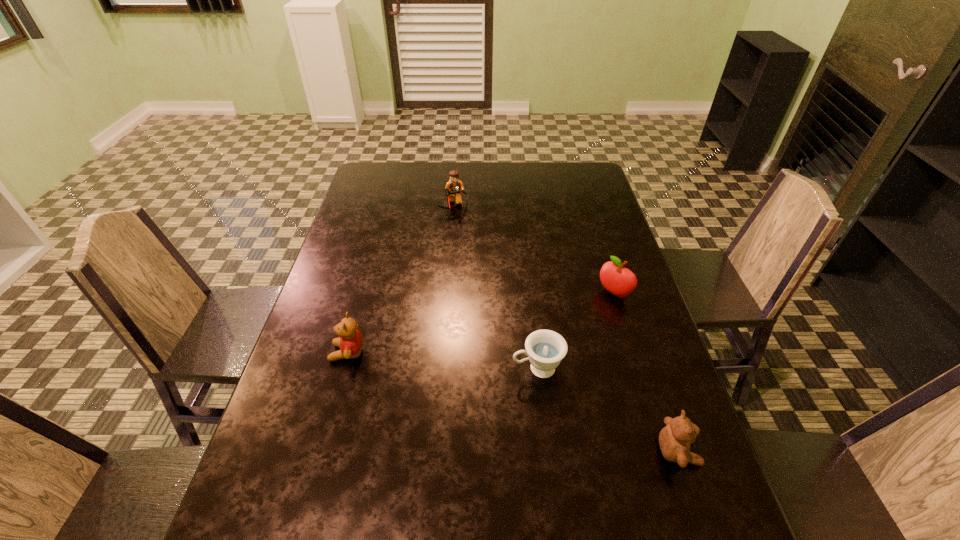
This screenshot has height=540, width=960. I want to click on vacant space on the desktop that is between the left teddy bear and the nearest object and is positioned on the front-facing side of the apple, so click(x=492, y=396).

Locate an element on the screen. The width and height of the screenshot is (960, 540). vacant space on the desktop that is between the leftmost object and the nearer teddy bear and is positioned on the side of the shortest object with the handle is located at coordinates (452, 384).

The image size is (960, 540). I want to click on vacant space on the desktop that is between the farther teddy bear and the nearer teddy bear and is positioned holding a crossbow in the hands of the farthest object, so click(x=504, y=400).